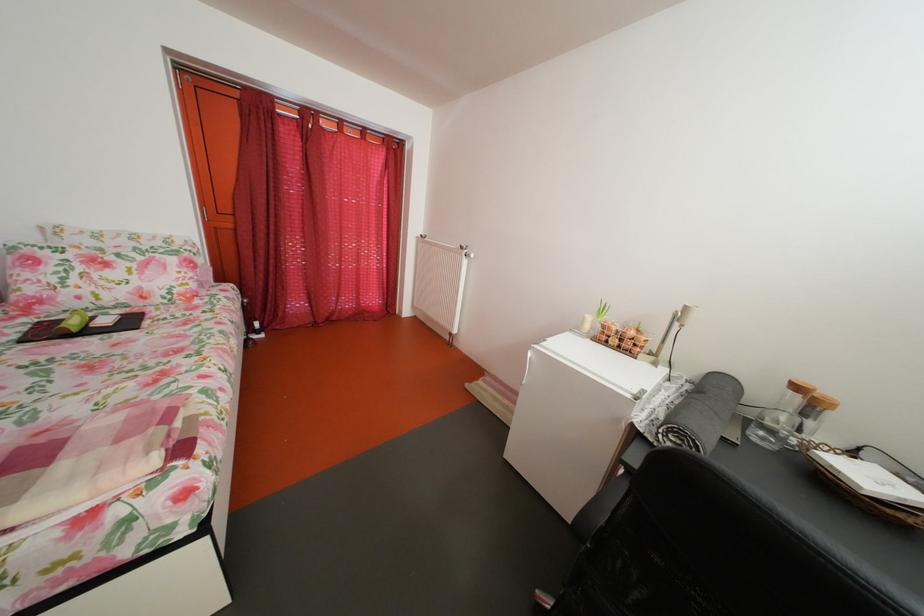
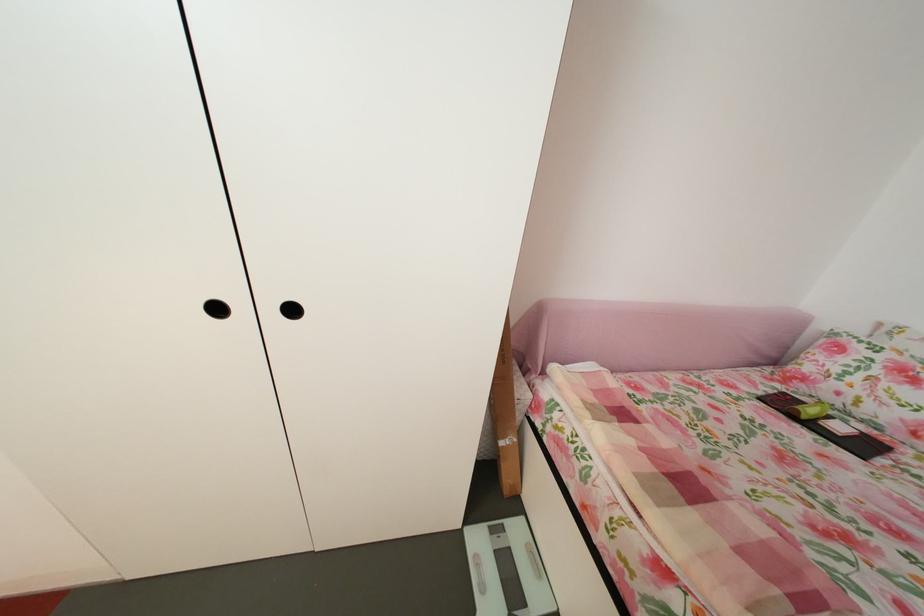
Based on the continuous images, in which direction is the camera rotating?

The camera rotated toward left-down.